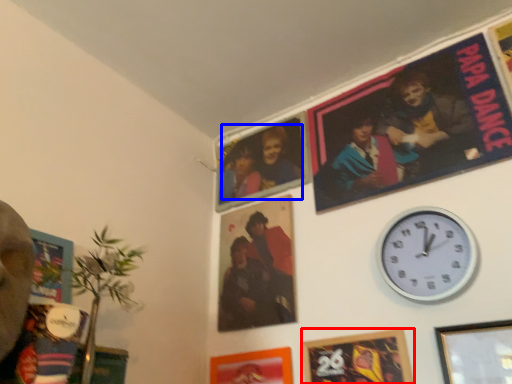
Question: Among these objects, which one is nearest to the camera, picture frame (highlighted by a red box) or couple (highlighted by a blue box)?

Choices:
 (A) picture frame
 (B) couple

Answer: (A)